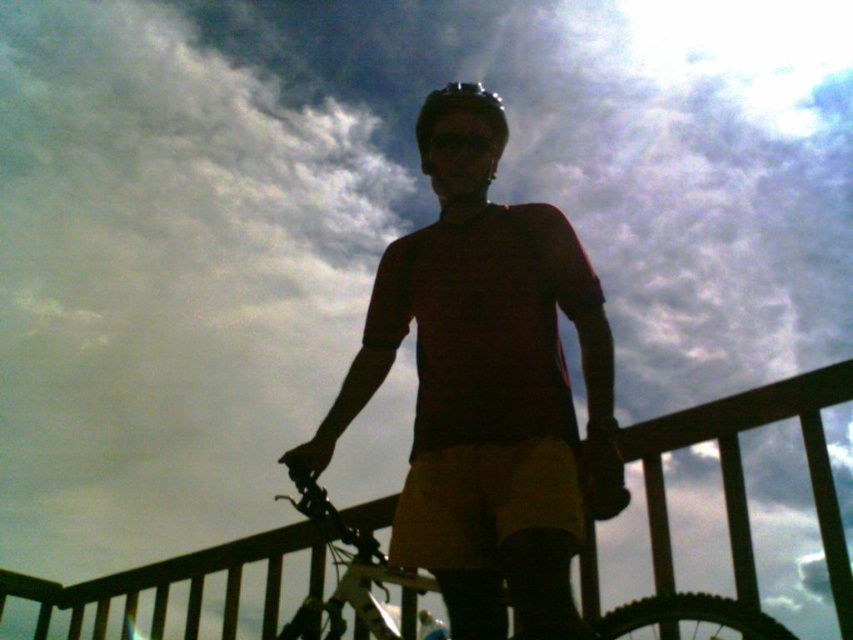
Can you confirm if matte red shirt at center is taller than matte black helmet at center?

Yes, matte red shirt at center is taller than matte black helmet at center.

Which is in front, point (596, 368) or point (474, 88)?

Point (596, 368)

The image size is (853, 640). I want to click on matte red shirt at center, so click(x=488, y=397).

Which is more to the left, black wood rail at center or matte black helmet at center?

black wood rail at center is more to the left.

Is black wood rail at center wider than matte black helmet at center?

Yes.

Which is behind, point (131, 577) or point (503, 115)?

Positioned behind is point (131, 577).

Where is `black wood rail at center`? The width and height of the screenshot is (853, 640). black wood rail at center is located at coordinates (743, 477).

Locate an element on the screen. The image size is (853, 640). matte red shirt at center is located at coordinates (488, 397).

Is matte red shirt at center smaller than metallic silver bicycle at center?

No, matte red shirt at center is not smaller than metallic silver bicycle at center.

Is point (549, 497) more distant than point (316, 492)?

No, it is not.

Locate an element on the screen. The image size is (853, 640). matte red shirt at center is located at coordinates (488, 397).